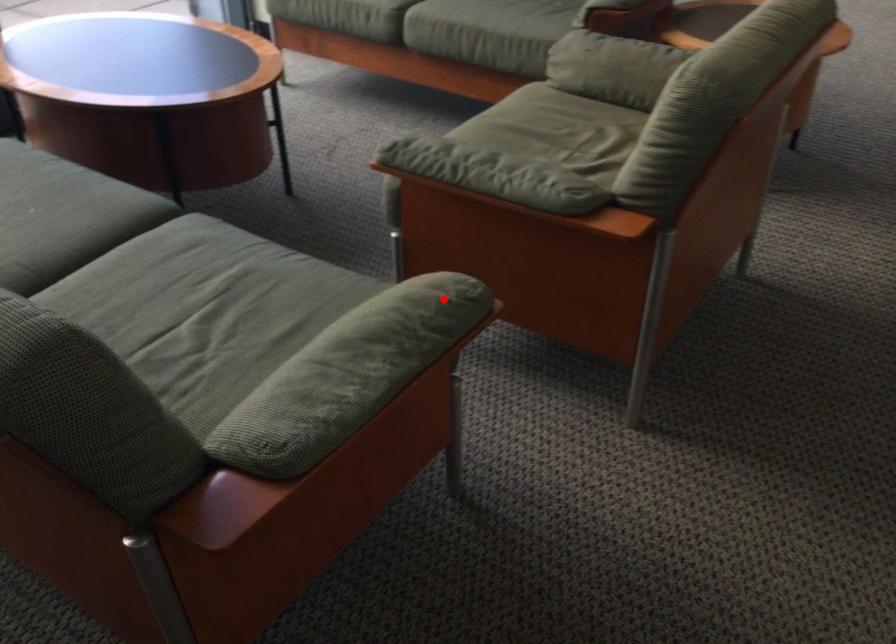
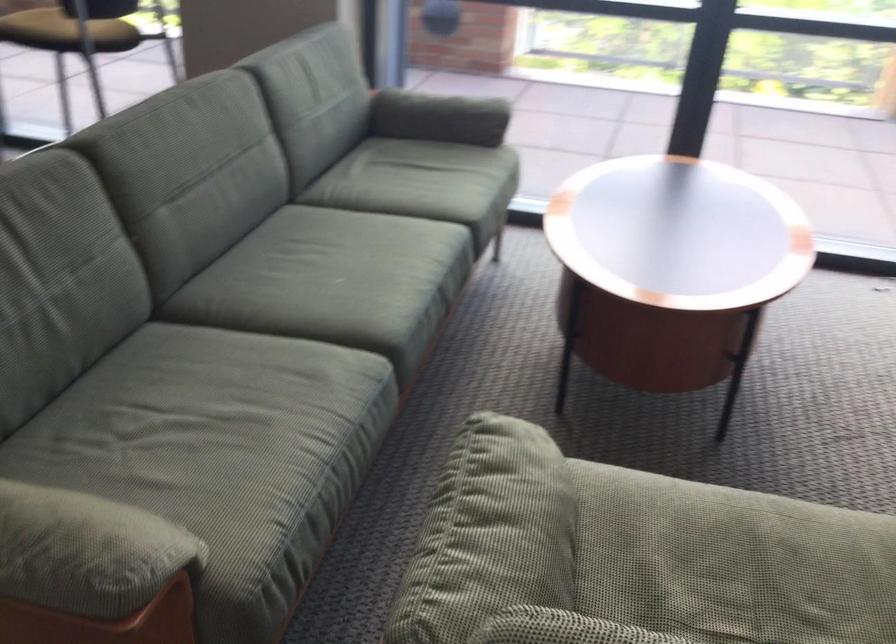
The point at the highlighted location is marked in the first image. Where is the corresponding point in the second image?

(82, 552)